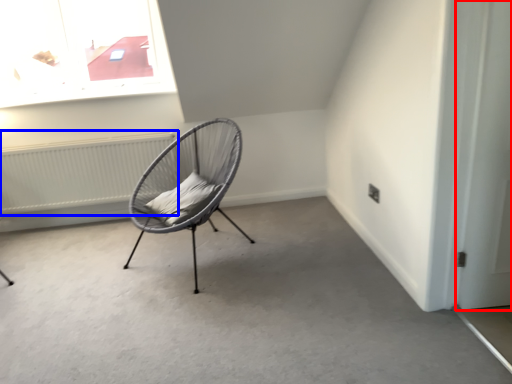
Question: Which point is closer to the camera, door (highlighted by a red box) or radiator (highlighted by a blue box)?

Choices:
 (A) door
 (B) radiator

Answer: (A)